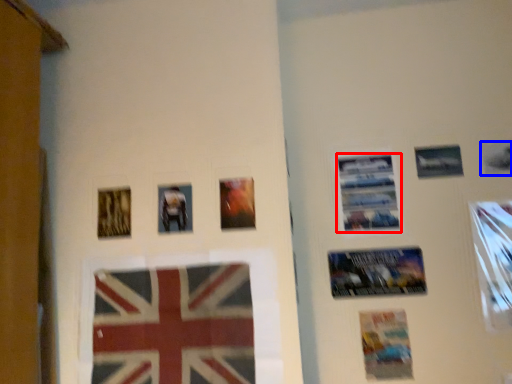
Question: Which of the following is the closest to the observer, poster (highlighted by a red box) or picture frame (highlighted by a blue box)?

Choices:
 (A) poster
 (B) picture frame

Answer: (B)